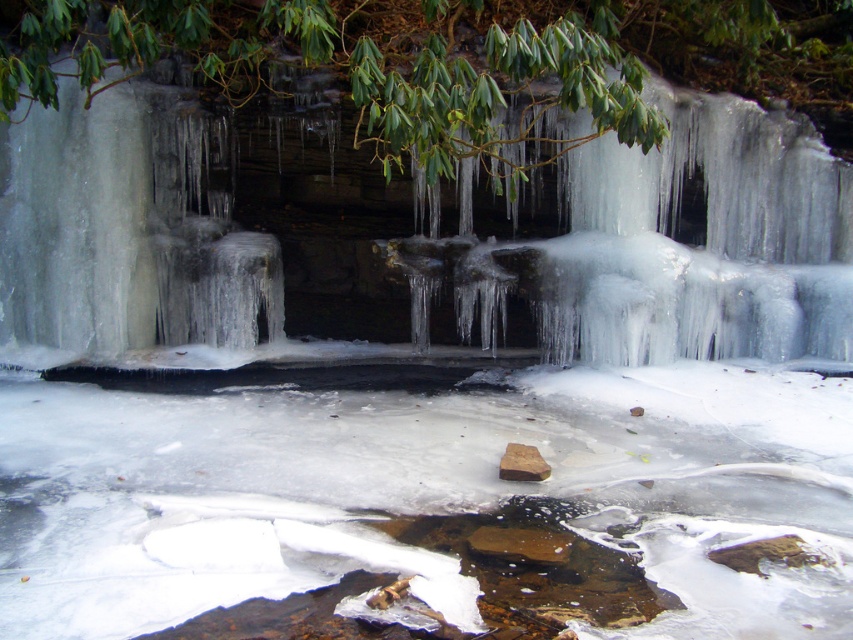
You are a photographer standing at the edge of the frozen stream. You want to capture a closeup shot of the green leafy branch at upper center without moving closer than 3 meters from your current position. Is this possible?

The green leafy branch at upper center is 3.01 meters away from the camera. Since you cannot move closer than 3 meters, you are just slightly beyond the required distance. Therefore, you cannot capture the closeup shot from your current position without moving closer.

You are a photographer standing at the edge of the frozen stream. You want to take a photo of both point (567,244) and point (520,458) in the scene. Which point should you focus on first to ensure both are in sharp focus?

You should focus on point (567,244) first because it is closer to the camera than point (520,458). This ensures that the depth of field will cover both points when focused on the closer one.